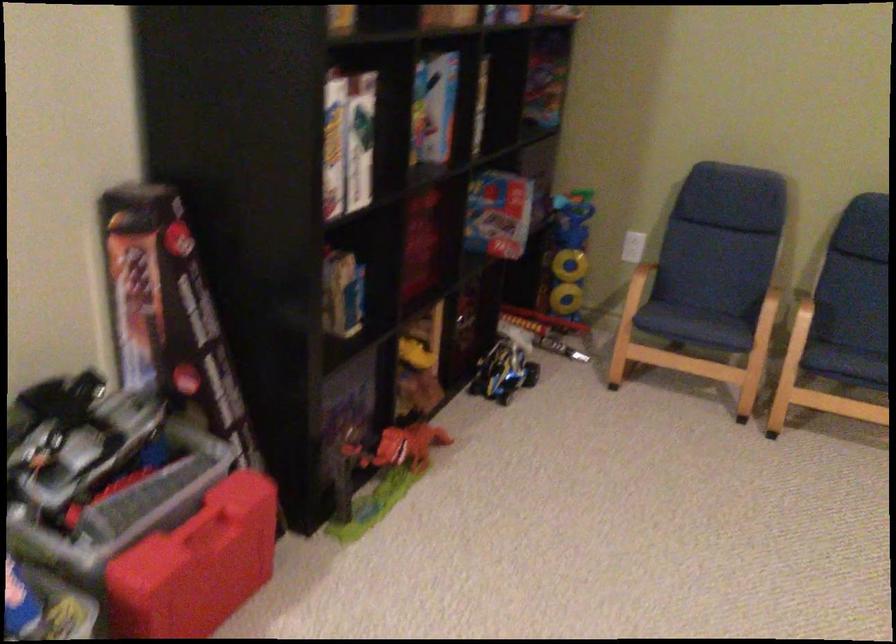
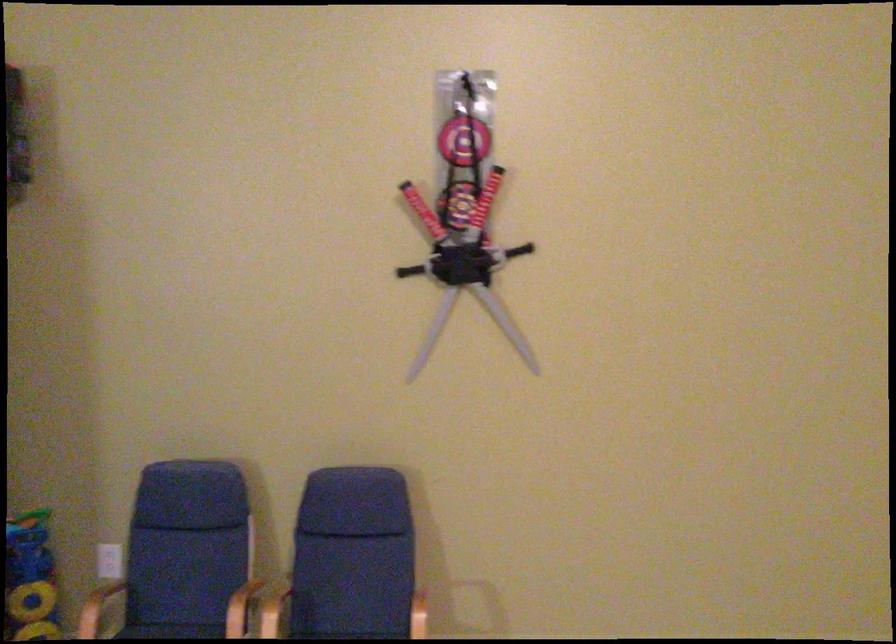
Question: In a continuous first-person perspective shot, in which direction is the camera moving?

Choices:
 (A) Left
 (B) Right
 (C) Forward
 (D) Backward

Answer: (B)